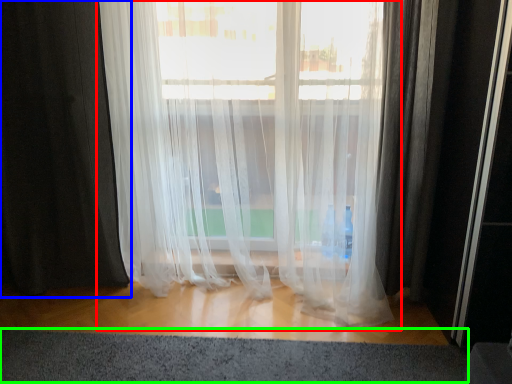
Question: Which object is positioned farthest from curtain (highlighted by a red box)? Select from curtain (highlighted by a blue box) and gray (highlighted by a green box).

Choices:
 (A) curtain
 (B) gray

Answer: (B)